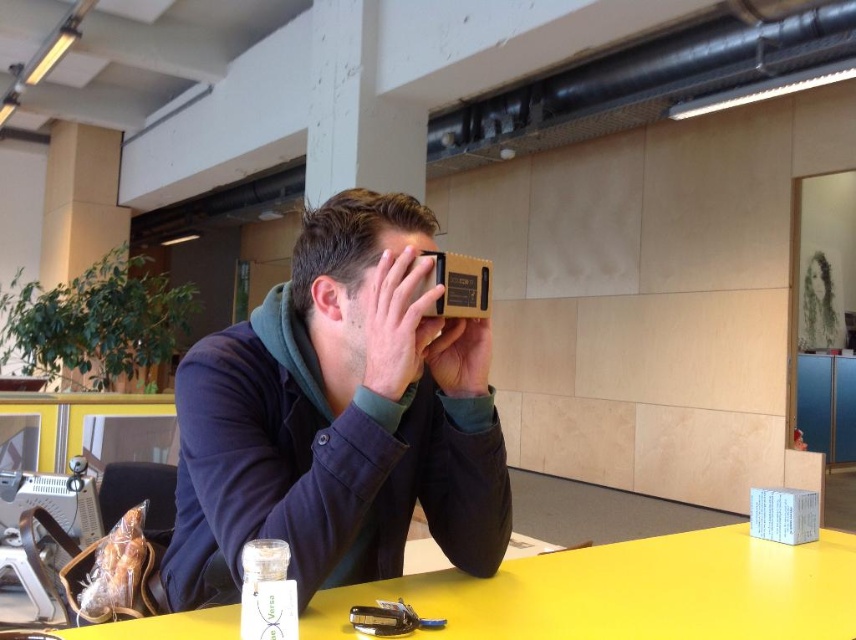
Does matte cardboard box at center appear on the left side of matte black cardboard at center?

Indeed, matte cardboard box at center is positioned on the left side of matte black cardboard at center.

Can you confirm if matte cardboard box at center is bigger than matte black cardboard at center?

Correct, matte cardboard box at center is larger in size than matte black cardboard at center.

Is point (348, 285) farther from camera compared to point (467, 340)?

No.

This screenshot has height=640, width=856. Find the location of `matte cardboard box at center`. matte cardboard box at center is located at coordinates (349, 237).

Can you confirm if yellow matte table at lower center is smaller than matte cardboard box at center?

Actually, yellow matte table at lower center might be larger than matte cardboard box at center.

Is yellow matte table at lower center above matte cardboard box at center?

No, yellow matte table at lower center is not above matte cardboard box at center.

This screenshot has height=640, width=856. What are the coordinates of `yellow matte table at lower center` in the screenshot? It's located at (629, 593).

The image size is (856, 640). What are the coordinates of `yellow matte table at lower center` in the screenshot? It's located at (629, 593).

Does point (348, 502) lie behind point (394, 212)?

No, (348, 502) is in front of (394, 212).

Does matte cardboard vr viewer at center have a lesser width compared to matte cardboard box at center?

No.

Is point (210, 467) in front of point (360, 237)?

Yes.

The width and height of the screenshot is (856, 640). I want to click on matte cardboard vr viewer at center, so click(x=331, y=420).